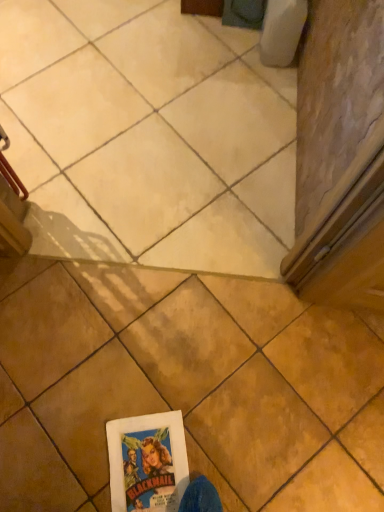
I want to click on free space above brown matte tile at center, the 2th tile in the top-to-bottom sequence (from a real-world perspective), so click(201, 394).